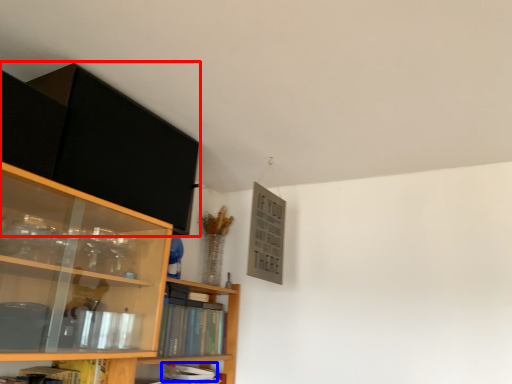
Question: Which object appears closest to the camera in this image, cabinetry (highlighted by a red box) or book (highlighted by a blue box)?

Choices:
 (A) cabinetry
 (B) book

Answer: (A)